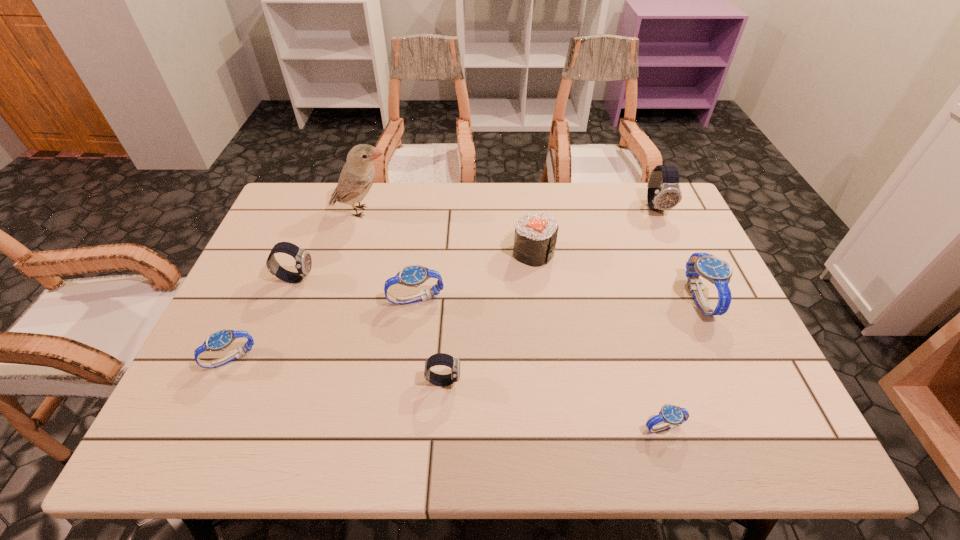
You are a GUI agent. You are given a task and a screenshot of the screen. Output one action in this format:
    pyautogui.click(x=<x>, y=<y>)
    Task: Click on the vacant region between the smallest blue watch and the tallest object
    The width and height of the screenshot is (960, 540).
    Given the screenshot: What is the action you would take?
    [513, 319]

Find the location of a particular element. empty space that is in between the shortest object and the third smallest blue watch is located at coordinates (540, 363).

Image resolution: width=960 pixels, height=540 pixels. I want to click on free spot between the second farthest dark watch and the nearest watch, so click(480, 353).

Where is `blank region between the second smallest blue watch and the white bird`? The width and height of the screenshot is (960, 540). blank region between the second smallest blue watch and the white bird is located at coordinates (297, 285).

This screenshot has height=540, width=960. I want to click on empty space that is in between the white bird and the second shortest watch, so click(297, 285).

You are a GUI agent. You are given a task and a screenshot of the screen. Output one action in this format:
    pyautogui.click(x=<x>, y=<y>)
    Task: Click on the empty space between the rightmost blue watch and the second dark watch from right to left
    The image size is (960, 540).
    Given the screenshot: What is the action you would take?
    pyautogui.click(x=571, y=339)

Locate which object ranks sixth in proximity to the white bird. Please provide its 2D coordinates. Your answer should be formatted as a tuple, i.e. [(x, y)], where the tuple contains the x and y coordinates of a point satisfying the conditions above.

[(663, 193)]

Where is `the sixth closest object relative to the biggest blue watch`? the sixth closest object relative to the biggest blue watch is located at coordinates (357, 176).

You are a GUI agent. You are given a task and a screenshot of the screen. Output one action in this format:
    pyautogui.click(x=<x>, y=<y>)
    Task: Click on the watch object that ranks as the closest to the fourth object from right to left
    This screenshot has height=540, width=960.
    Given the screenshot: What is the action you would take?
    pyautogui.click(x=413, y=275)

Identify which watch is located as the second nearest to the second shortest object. Please provide its 2D coordinates. Your answer should be formatted as a tuple, i.e. [(x, y)], where the tuple contains the x and y coordinates of a point satisfying the conditions above.

[(413, 275)]